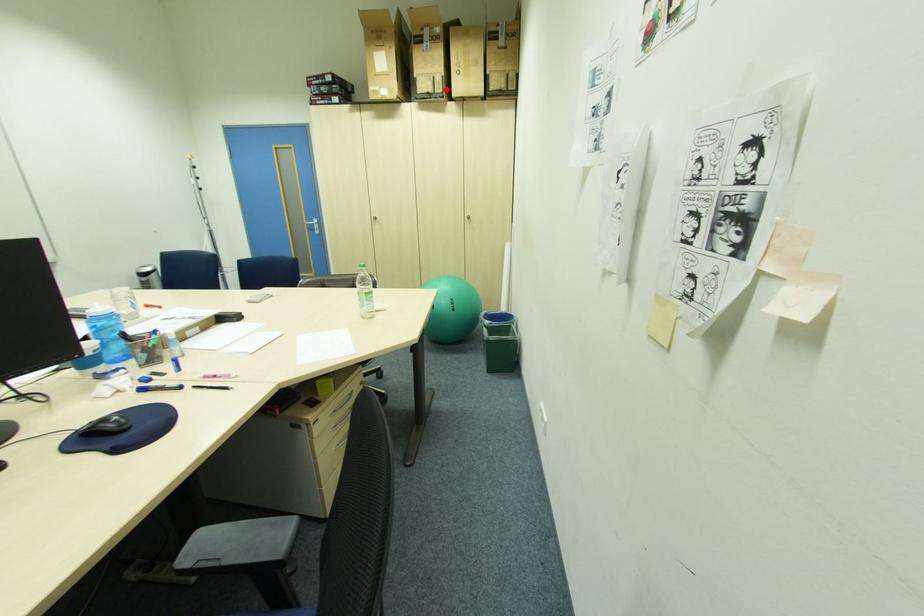
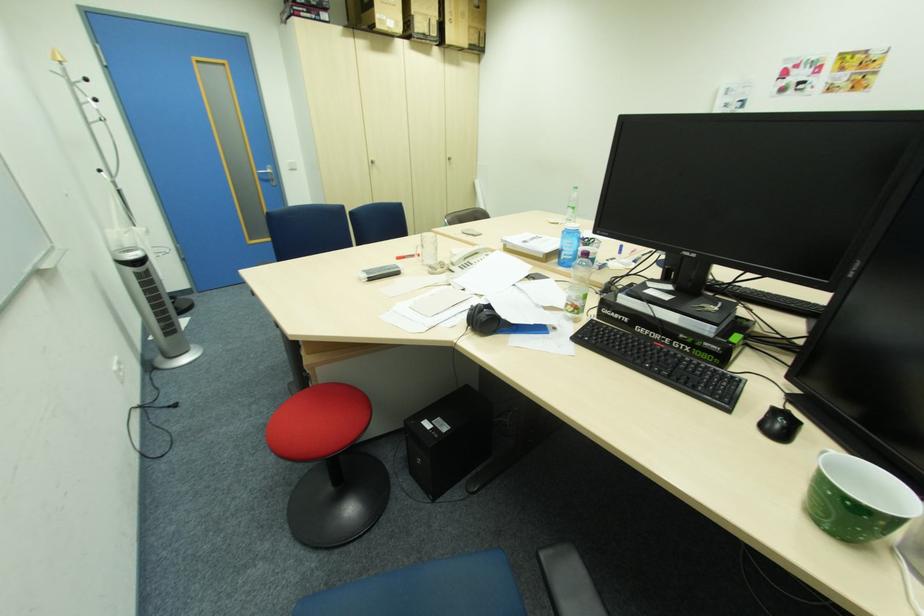
Find the pixel in the second image that matches the highlighted location in the first image.

(441, 31)